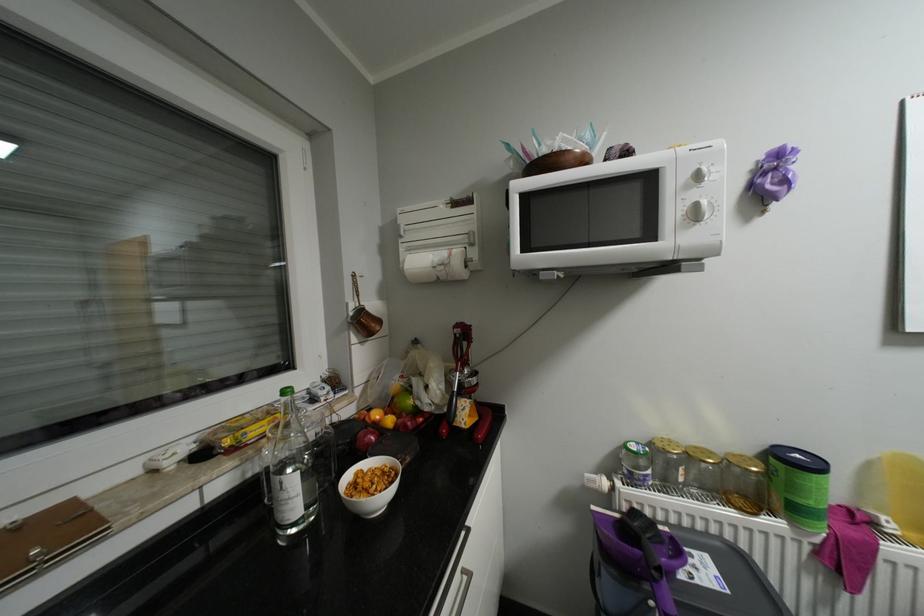
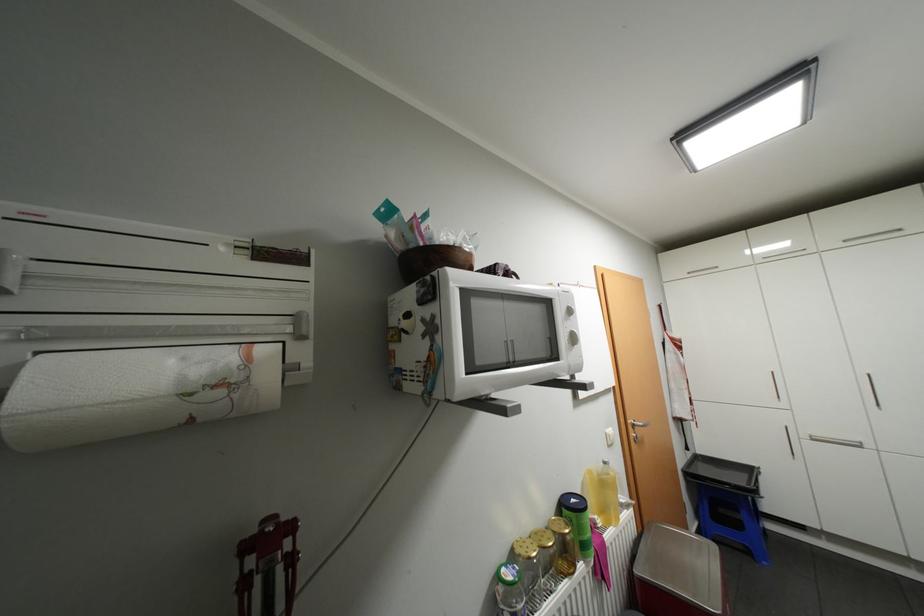
Where in the second image is the point corresponding to (x=408, y=236) from the first image?

(6, 291)